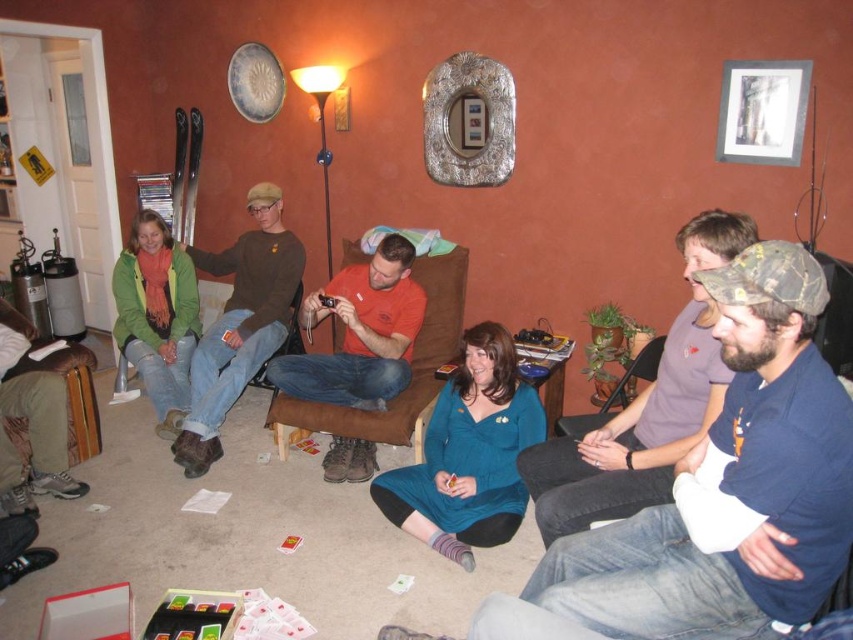
Does dark blue shirt at center appear over brown leather armchair at lower left?

Yes.

From the picture: Which is below, dark blue shirt at center or brown leather armchair at lower left?

brown leather armchair at lower left is lower down.

Is point (630, 467) positioned behind point (97, 451)?

No.

Find the location of a particular element. The width and height of the screenshot is (853, 640). dark blue shirt at center is located at coordinates (643, 406).

Can you confirm if orange cotton shirt at center is positioned above brown sweater at upper left?

No.

Which is behind, point (418, 326) or point (277, 321)?

Point (277, 321)

Is point (344, 291) less distant than point (207, 449)?

No, it is not.

Where is `orange cotton shirt at center`? This screenshot has width=853, height=640. orange cotton shirt at center is located at coordinates (358, 332).

Who is more forward, (352, 468) or (73, 445)?

Point (352, 468) is more forward.

Which is in front, point (338, 435) or point (85, 404)?

Point (338, 435)

I want to click on orange cotton shirt at center, so click(358, 332).